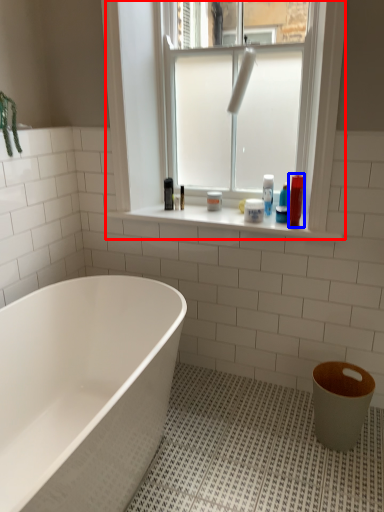
Question: Which object appears farthest to the camera in this image, window (highlighted by a red box) or toiletry (highlighted by a blue box)?

Choices:
 (A) window
 (B) toiletry

Answer: (B)